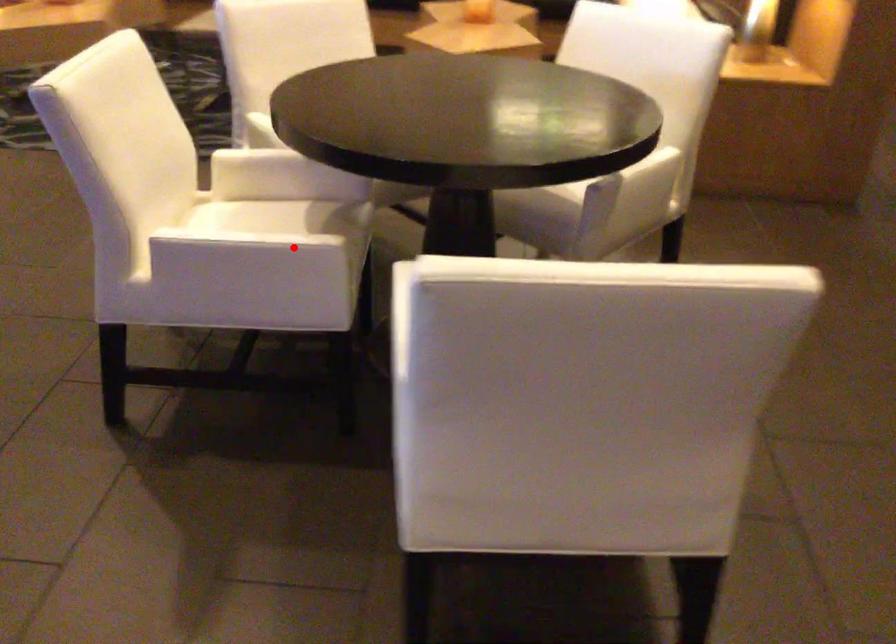
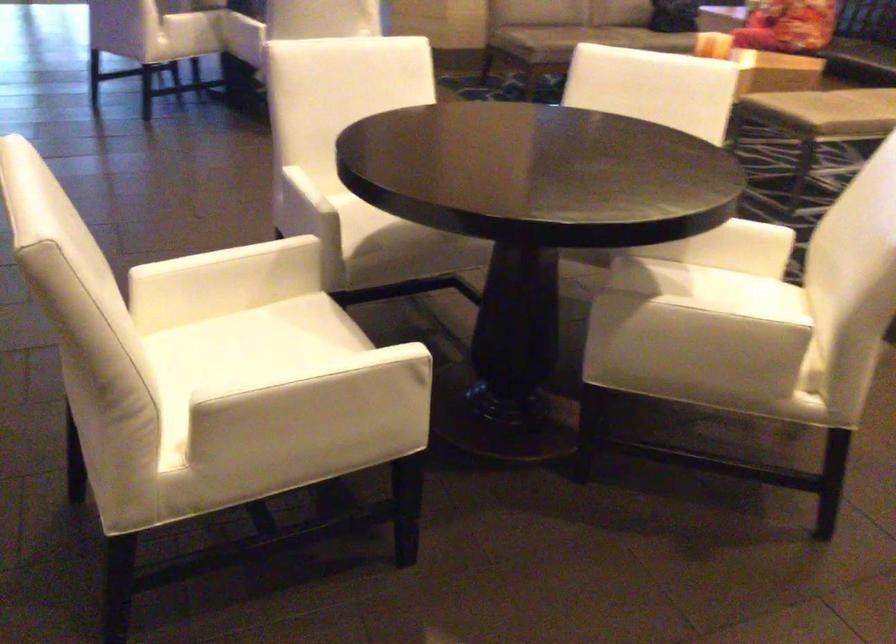
Question: I am providing you with two images of the same scene from different viewpoints. In image1, a red point is highlighted. Considering the same 3D point in image2, which of the following is correct?

Choices:
 (A) It is closer
 (B) It is farther

Answer: (B)